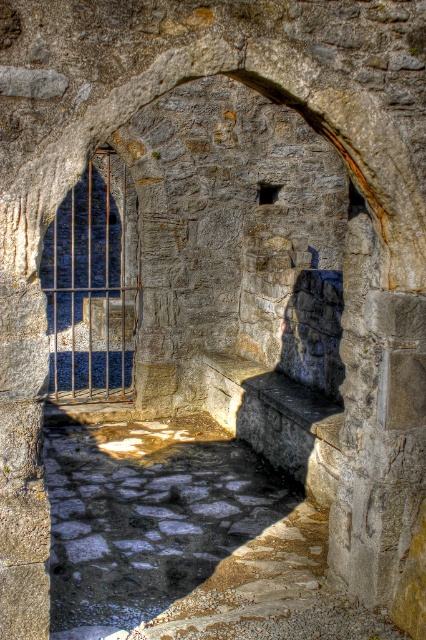
You are standing in front of the stone archway and want to reach both points marked in the image. Which point, point (x=290, y=636) or point (x=40, y=262), is closer to you?

Point (x=290, y=636) is closer to the viewer than point (x=40, y=262).

In the scene shown: You are a traveler approaching the stone archway and need to cross the area. You see the stone cobblestone pathway at center and the rusty metal gate at center. Which object is higher and might require a step up?

The stone cobblestone pathway at center is higher than the rusty metal gate at center, so you would need to step up onto the stone cobblestone pathway at center.

Based on the photo, you are standing in front of the stone archway and want to walk through the rusty metal gate at center. To your left, there is a stone cobblestone pathway at center. Which direction should you turn to reach the pathway?

The stone cobblestone pathway at center is to the right of the rusty metal gate at center, so you should turn to your right to reach the pathway.